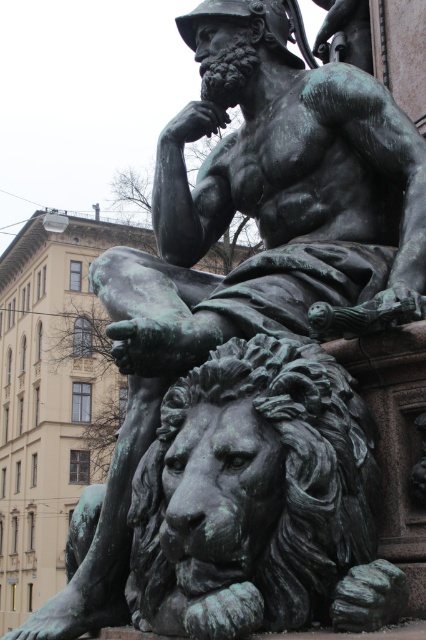
Question: Among these points, which one is farthest from the camera?

Choices:
 (A) (397, 305)
 (B) (385, 612)

Answer: (A)

Question: Where is green patina statue at center located in relation to green patina lion at lower left in the image?

Choices:
 (A) above
 (B) below

Answer: (A)

Question: Which point is closer to the camera taking this photo?

Choices:
 (A) (325, 332)
 (B) (347, 497)

Answer: (B)

Question: Can you confirm if green patina statue at center is positioned below green patina lion at lower left?

Choices:
 (A) yes
 (B) no

Answer: (B)

Question: Is green patina statue at center positioned behind green patina lion at lower left?

Choices:
 (A) no
 (B) yes

Answer: (B)